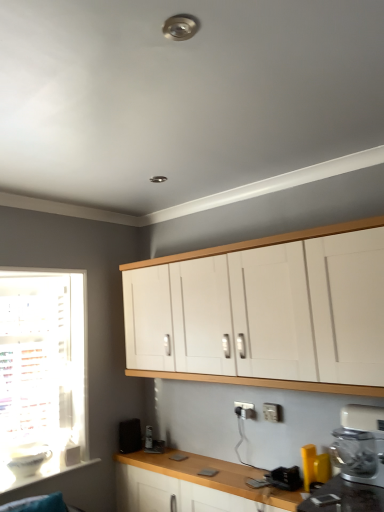
Question: Is white plastic window sill at lower left spatially inside wooden at lower center, or outside of it?

Choices:
 (A) outside
 (B) inside

Answer: (A)

Question: From a real-world perspective, is white plastic window sill at lower left positioned above or below wooden at lower center?

Choices:
 (A) below
 (B) above

Answer: (B)

Question: Which object is positioned farthest from the white plastic window sill at lower left?

Choices:
 (A) white plastic mixer at lower right
 (B) white glossy bowl at lower left, which appears as the first appliance when viewed from the left
 (C) white plastic electric outlet at lower center
 (D) wooden at lower center
 (E) white matte cabinet at upper center

Answer: (A)

Question: Which object is the farthest from the yellow plastic spatula at lower right, which ranks as the third appliance in left-to-right order?

Choices:
 (A) white matte cabinet at upper center
 (B) metallic silver toaster at lower center, the 2th appliance when ordered from back to front
 (C) white glossy bowl at lower left, the 3th appliance from the right
 (D) wooden at lower center
 (E) white plastic mixer at lower right

Answer: (C)